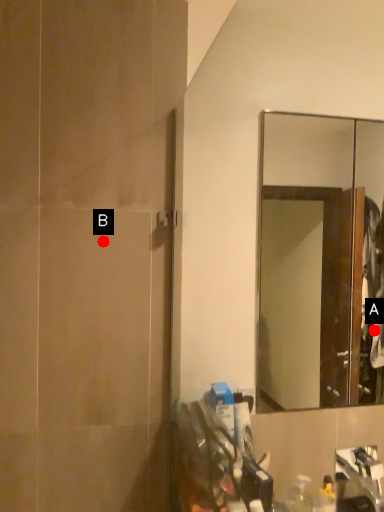
Question: Two points are circled on the image, labeled by A and B beside each circle. Which point is further to the camera?

Choices:
 (A) A is further
 (B) B is further

Answer: (A)